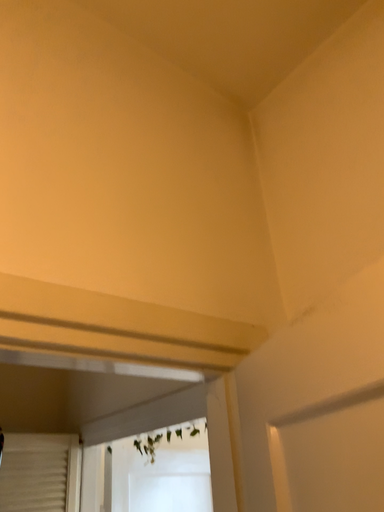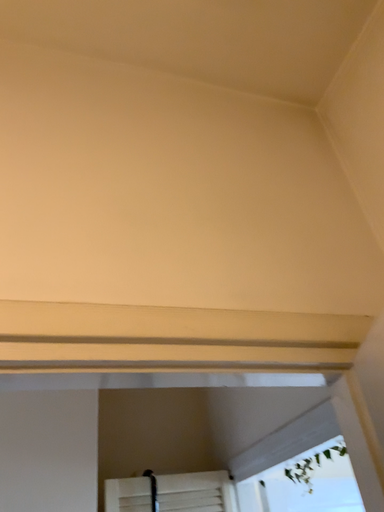
Question: Which way did the camera rotate in the video?

Choices:
 (A) rotated left
 (B) rotated right

Answer: (A)